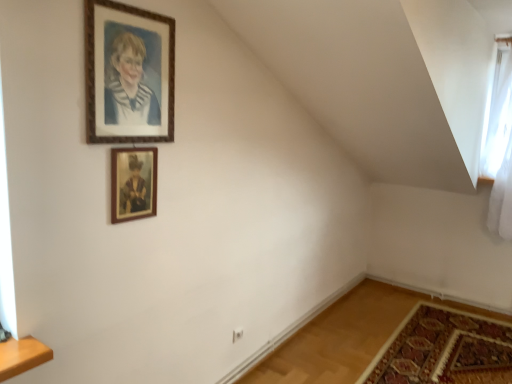
Question: Is carpeted mat at lower right closer to camera compared to white sheer curtain at upper right?

Choices:
 (A) yes
 (B) no

Answer: (A)

Question: From the image's perspective, is carpeted mat at lower right below white sheer curtain at upper right?

Choices:
 (A) no
 (B) yes

Answer: (B)

Question: Does carpeted mat at lower right have a lesser height compared to white sheer curtain at upper right?

Choices:
 (A) no
 (B) yes

Answer: (B)

Question: Considering the relative sizes of carpeted mat at lower right and white sheer curtain at upper right in the image provided, is carpeted mat at lower right taller than white sheer curtain at upper right?

Choices:
 (A) yes
 (B) no

Answer: (B)

Question: Could you tell me if carpeted mat at lower right is turned towards white sheer curtain at upper right?

Choices:
 (A) no
 (B) yes

Answer: (A)

Question: Is point (498, 337) positioned closer to the camera than point (507, 72)?

Choices:
 (A) closer
 (B) farther

Answer: (A)

Question: Relative to white sheer curtain at upper right, is carpeted mat at lower right in front or behind?

Choices:
 (A) front
 (B) behind

Answer: (A)

Question: Considering the positions of carpeted mat at lower right and white sheer curtain at upper right in the image, is carpeted mat at lower right taller or shorter than white sheer curtain at upper right?

Choices:
 (A) short
 (B) tall

Answer: (A)

Question: Is carpeted mat at lower right inside or outside of white sheer curtain at upper right?

Choices:
 (A) inside
 (B) outside

Answer: (B)

Question: Is point (419, 349) closer or farther from the camera than point (106, 51)?

Choices:
 (A) closer
 (B) farther

Answer: (B)

Question: Do you think carpeted mat at lower right is within wooden frame at upper center, the 2th picture frame from the bottom, or outside of it?

Choices:
 (A) inside
 (B) outside

Answer: (B)

Question: From the image's perspective, is carpeted mat at lower right positioned above or below wooden frame at upper center, the 2th picture frame from the bottom?

Choices:
 (A) below
 (B) above

Answer: (A)

Question: Is carpeted mat at lower right to the left or to the right of wooden frame at upper center, the 2th picture frame from the bottom, in the image?

Choices:
 (A) left
 (B) right

Answer: (B)

Question: From the image's perspective, is carpeted mat at lower right located above or below wooden picture frame at upper center, the first picture frame from the bottom?

Choices:
 (A) below
 (B) above

Answer: (A)

Question: Considering their positions, is carpeted mat at lower right located in front of or behind wooden picture frame at upper center, the first picture frame from the bottom?

Choices:
 (A) behind
 (B) front

Answer: (A)